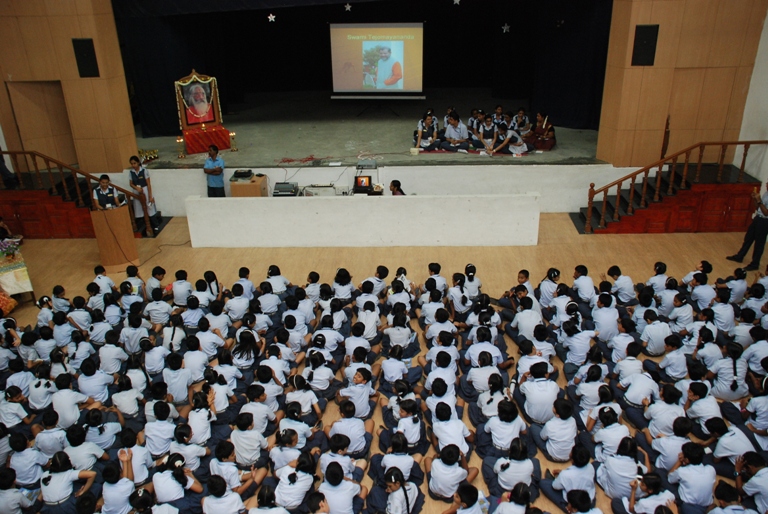
The height and width of the screenshot is (514, 768). Find the location of `hand rail`. hand rail is located at coordinates (620, 179).